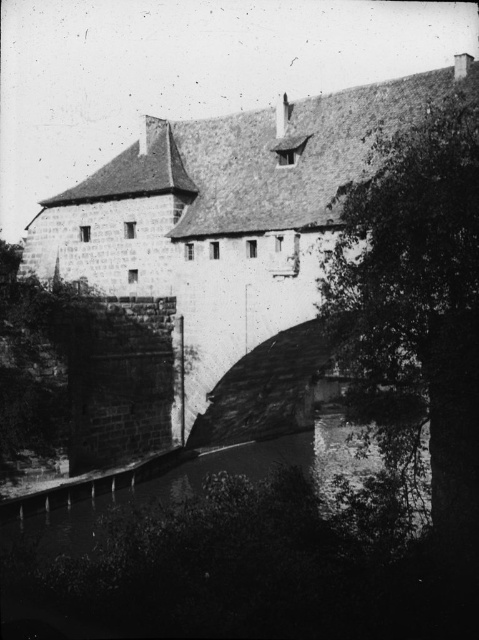
Which of these two, stone wall at center or green leafy tree at right, stands shorter?

green leafy tree at right

You are a GUI agent. You are given a task and a screenshot of the screen. Output one action in this format:
    pyautogui.click(x=<x>, y=<y>)
    Task: Click on the stone wall at center
    The height and width of the screenshot is (640, 479).
    Given the screenshot: What is the action you would take?
    pyautogui.click(x=228, y=214)

Is point (185, 218) more distant than point (463, 440)?

Yes, point (185, 218) is farther from viewer.

The image size is (479, 640). Find the location of `stone wall at center`. stone wall at center is located at coordinates (228, 214).